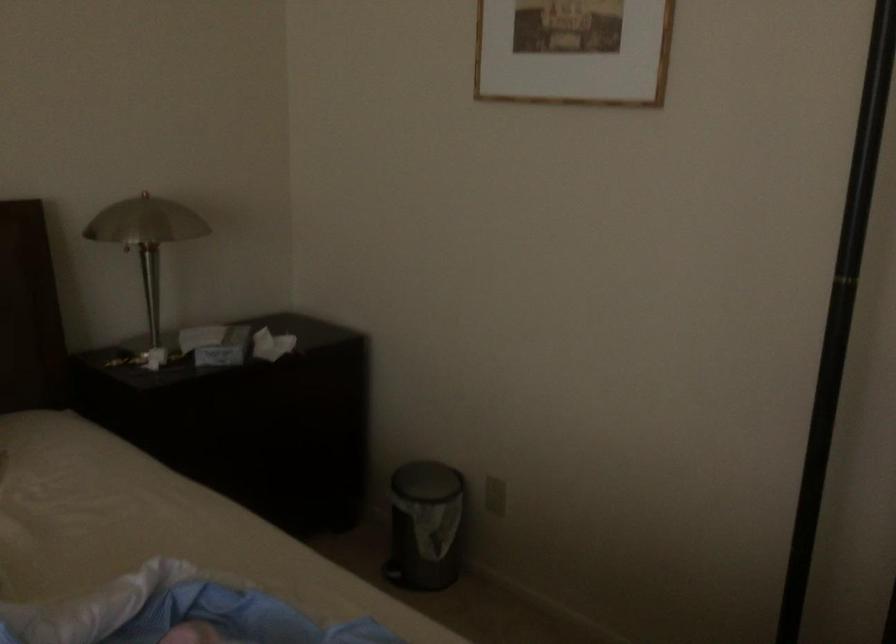
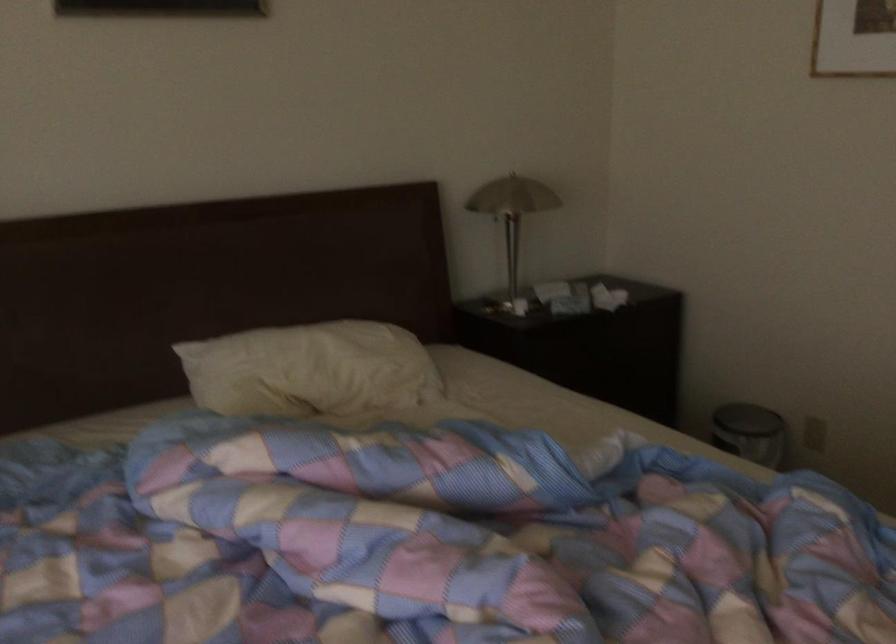
In the second image, find the point that corresponds to [426,500] in the first image.

(748, 431)